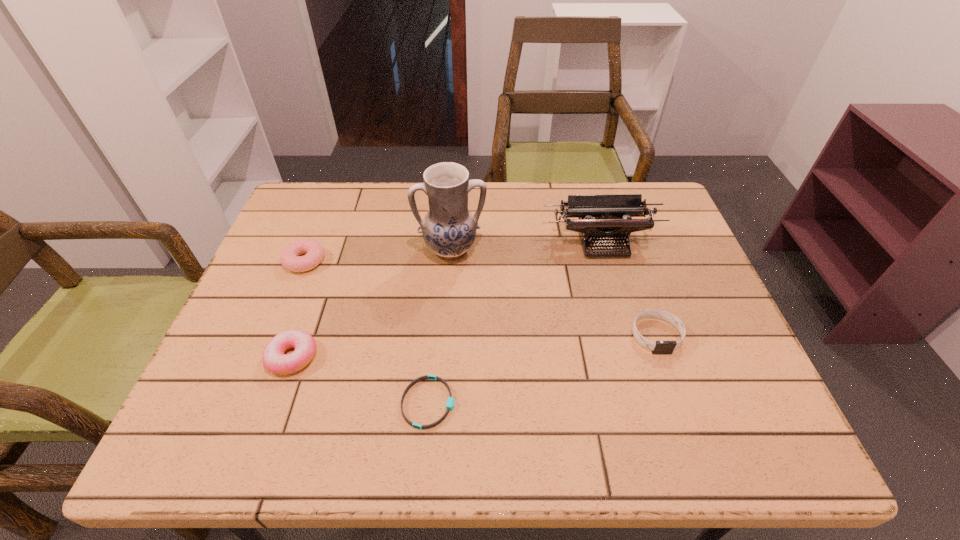
Find the location of a particular element. The height and width of the screenshot is (540, 960). vacant space at the near edge of the desktop is located at coordinates (572, 425).

Locate an element on the screen. This screenshot has height=540, width=960. free space at the left edge of the desktop is located at coordinates pyautogui.click(x=217, y=380).

The image size is (960, 540). What are the coordinates of `vacant space at the right edge of the desktop` in the screenshot? It's located at (648, 242).

At what (x,y) coordinates should I click in order to perform the action: click on vacant space at the far left corner of the desktop. Please return your answer as a coordinate pair (x, y). Image resolution: width=960 pixels, height=540 pixels. Looking at the image, I should click on (325, 231).

Identify the location of free space at the near left corner of the desktop. The width and height of the screenshot is (960, 540). (248, 456).

Identify the location of unoccupied position between the farther doughnut and the nearer doughnut. The height and width of the screenshot is (540, 960). (299, 309).

Where is `empty space that is in between the farther doughnut and the farther wristband`? The width and height of the screenshot is (960, 540). empty space that is in between the farther doughnut and the farther wristband is located at coordinates [x=480, y=298].

Locate an element on the screen. unoccupied position between the typewriter and the pottery is located at coordinates (527, 246).

Identify the location of empty space that is in between the pottery and the taller wristband. (554, 293).

Identify the location of empty location between the farther doughnut and the pottery. (378, 255).